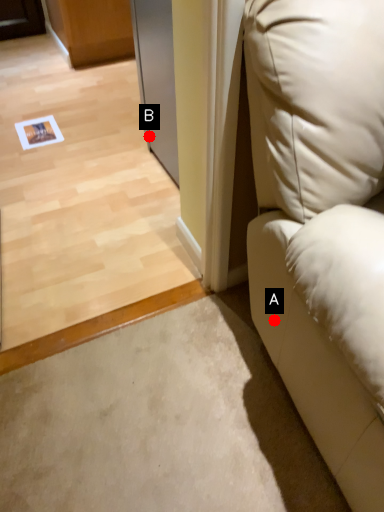
Question: Two points are circled on the image, labeled by A and B beside each circle. Among these points, which one is nearest to the camera?

Choices:
 (A) A is closer
 (B) B is closer

Answer: (A)